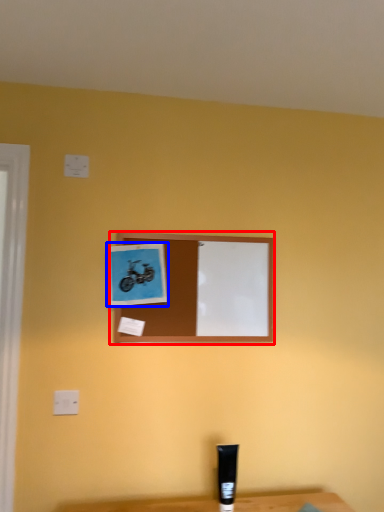
Question: Which point is further to the camera, picture frame (highlighted by a red box) or picture frame (highlighted by a blue box)?

Choices:
 (A) picture frame
 (B) picture frame

Answer: (A)